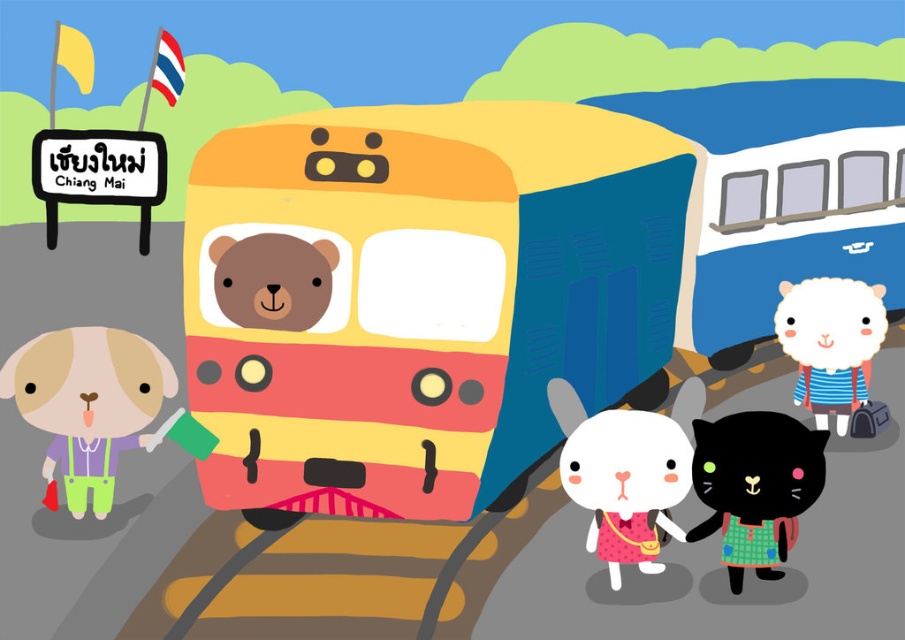
Can you confirm if pastel purple fabric dog at lower left is positioned to the right of white woolen sheep at center?

In fact, pastel purple fabric dog at lower left is to the left of white woolen sheep at center.

Between point (77, 509) and point (812, 387), which one is positioned in front?

Positioned in front is point (77, 509).

Is point (56, 420) more distant than point (798, 320)?

No, it is not.

Image resolution: width=905 pixels, height=640 pixels. What are the coordinates of `pastel purple fabric dog at lower left` in the screenshot? It's located at (87, 404).

Does white matte rabbit at center have a greater width compared to brown matte bear at center?

Yes, white matte rabbit at center is wider than brown matte bear at center.

Between white matte rabbit at center and brown matte bear at center, which one has less height?

With less height is brown matte bear at center.

Is point (601, 512) in front of point (321, 300)?

Yes, it is in front of point (321, 300).

Find the location of a particular element. The height and width of the screenshot is (640, 905). white matte rabbit at center is located at coordinates (622, 477).

Measure the distance from yellow matte train at center to white woolen sheep at center.

yellow matte train at center and white woolen sheep at center are 3.85 feet apart from each other.

Does yellow matte train at center have a lesser width compared to white woolen sheep at center?

No.

Between point (245, 433) and point (799, 289), which one is positioned in front?

Point (245, 433) is more forward.

I want to click on yellow matte train at center, so click(x=445, y=294).